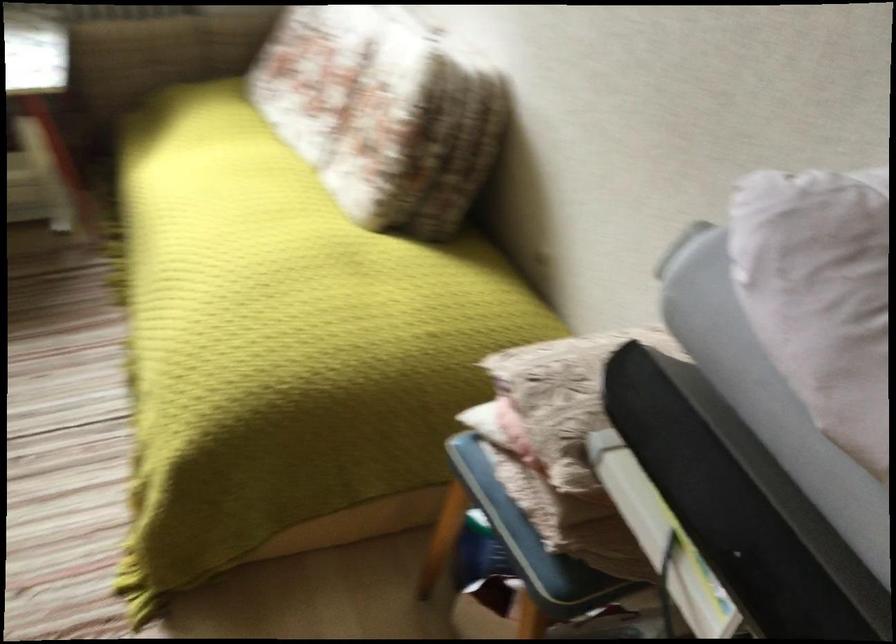
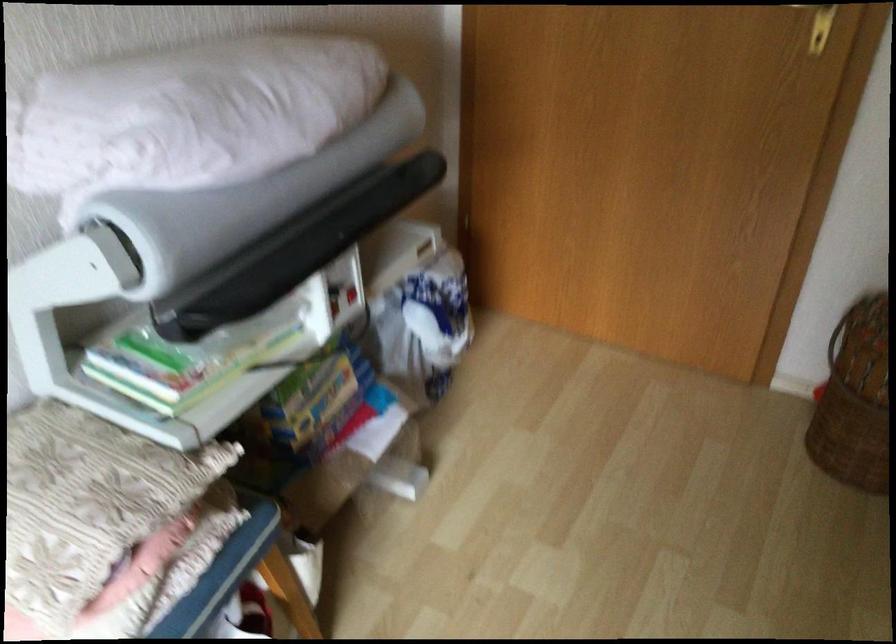
Locate, in the second image, the point that corresponds to (x=556, y=375) in the first image.

(102, 516)